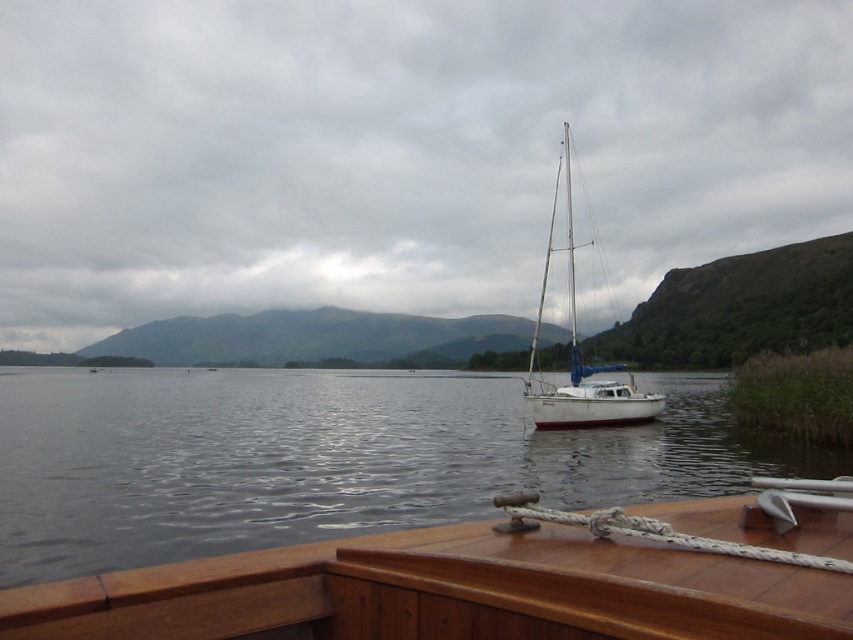
Question: Is clear water at center below white matte sailboat at center?

Choices:
 (A) yes
 (B) no

Answer: (A)

Question: Which of these objects is positioned closest to the white matte sailboat at center?

Choices:
 (A) clear water at center
 (B) wooden deck at center

Answer: (B)

Question: Based on their relative distances, which object is farther from the wooden deck at center?

Choices:
 (A) white matte sailboat at center
 (B) clear water at center

Answer: (A)

Question: Which of the following is the closest to the observer?

Choices:
 (A) (265, 557)
 (B) (265, 474)

Answer: (A)

Question: Can you confirm if clear water at center is positioned above wooden deck at center?

Choices:
 (A) no
 (B) yes

Answer: (A)

Question: In this image, where is clear water at center located relative to wooden deck at center?

Choices:
 (A) above
 (B) below

Answer: (B)